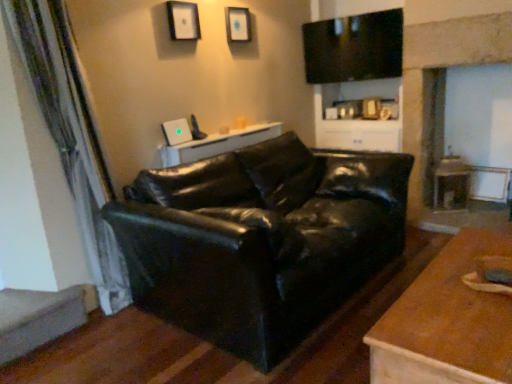
Identify the location of free space in front of wooden side table at right. The image size is (512, 384). (467, 222).